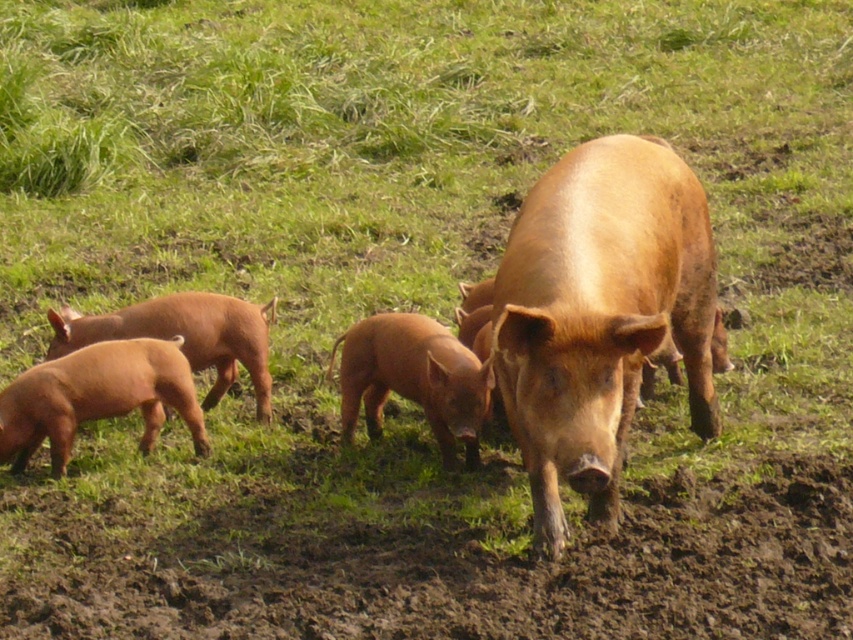
You are standing in the field and see the matte brown pig at center and the smooth brown piglet at lower left. Which one is positioned to the right of the other?

The matte brown pig at center is positioned to the right of the smooth brown piglet at lower left.